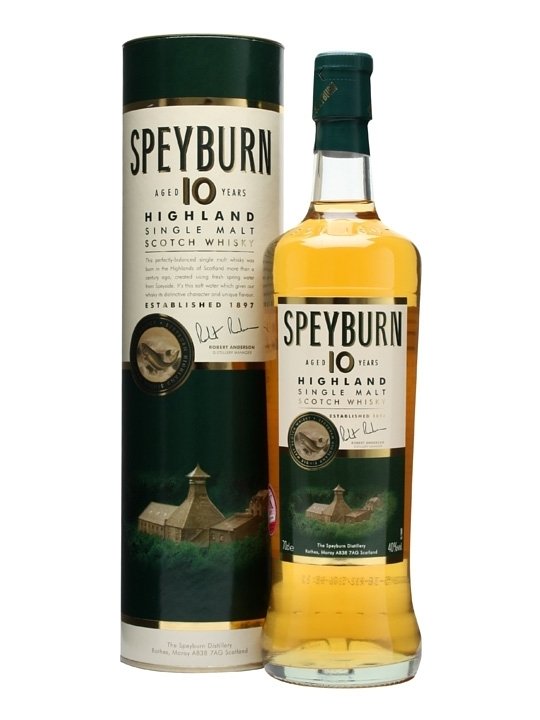
Find the location of a particular element. This screenshot has width=540, height=720. bottle is located at coordinates (379, 592).